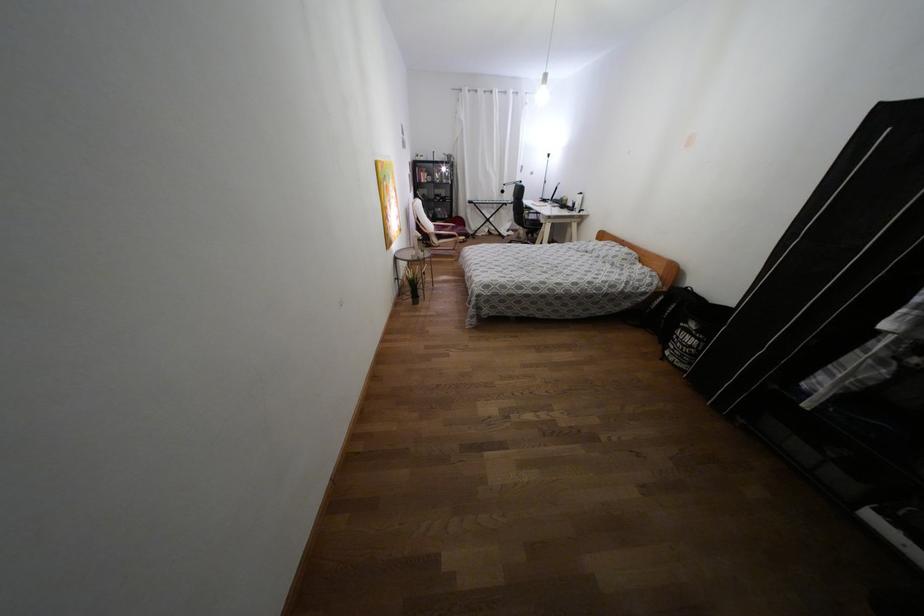
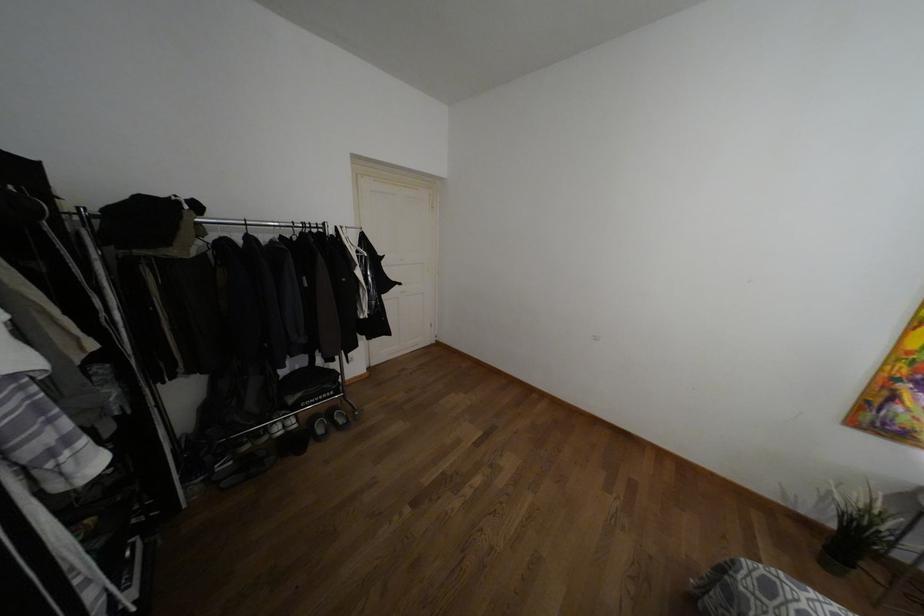
Locate, in the second image, the point that corresponds to point (485, 286) in the first image.

(769, 588)